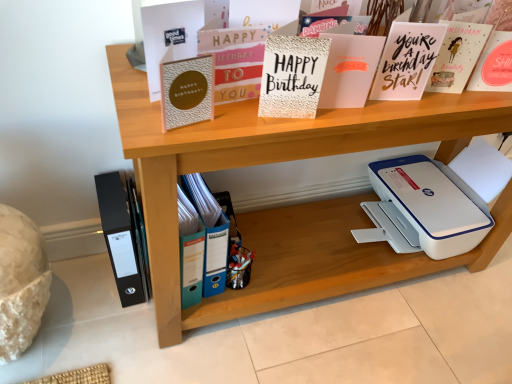
I want to click on white plastic printer at lower right, so click(424, 209).

In order to face black matte folder at lower left, should I rotate leftwards or rightwards?

A 17.359 degree turn to the left will do.

Describe the element at coordinates (192, 266) in the screenshot. I see `blue plastic ring binder at center, the seventh paperback book positioned from the right` at that location.

What is the approximate height of matte pink card at upper right, placed as the 1th paperback book when sorted from right to left?

It is 17.40 centimeters.

What do you see at coordinates (187, 91) in the screenshot? This screenshot has height=384, width=512. I see `gold textured card at upper center, which is the sixth paperback book from right to left` at bounding box center [187, 91].

Measure the distance between matte gold card at upper center, which is counted as the third paperback book, starting from the left, and camera.

matte gold card at upper center, which is counted as the third paperback book, starting from the left, is 30.93 inches away from camera.

Locate an element on the screen. metallic pen holder at center is located at coordinates (239, 266).

Describe the element at coordinates (349, 69) in the screenshot. The height and width of the screenshot is (384, 512). I see `matte gold card at center, marked as the fifth paperback book in a left-to-right arrangement` at that location.

Find the location of a particular element. Image resolution: width=512 pixels, height=384 pixels. white plastic printer at lower right is located at coordinates (424, 209).

Is black matte folder at lower left to the left of metallic pen holder at center from the viewer's perspective?

Yes, black matte folder at lower left is to the left of metallic pen holder at center.

From a real-world perspective, is black matte folder at lower left on top of metallic pen holder at center?

Indeed, from a real-world perspective, black matte folder at lower left stands above metallic pen holder at center.

In the image, there is a black matte folder at lower left. Where is `toy below it (from a real-world perspective)`? This screenshot has height=384, width=512. toy below it (from a real-world perspective) is located at coordinates (239, 266).

Which of these two, black matte folder at lower left or metallic pen holder at center, is bigger?

black matte folder at lower left is bigger.

Is metallic pen holder at center oriented away from blue plastic file at lower center?

No, metallic pen holder at center's orientation is not away from blue plastic file at lower center.

Based on the photo, from the image's perspective, between metallic pen holder at center and blue plastic file at lower center, who is located below?

metallic pen holder at center appears lower in the image.

Can you confirm if metallic pen holder at center is thinner than blue plastic file at lower center?

Yes.

Considering the positions of point (234, 262) and point (206, 221), is point (234, 262) closer or farther from the camera than point (206, 221)?

Point (234, 262) is farther from the camera than point (206, 221).

Is gold textured card at upper center, the 2th paperback book in the left-to-right sequence, oriented towards black matte folder at lower left?

No, gold textured card at upper center, the 2th paperback book in the left-to-right sequence, does not turn towards black matte folder at lower left.

How distant is gold textured card at upper center, the 2th paperback book in the left-to-right sequence, from black matte folder at lower left?

23.73 inches.

Who is more distant, gold textured card at upper center, the 2th paperback book in the left-to-right sequence, or black matte folder at lower left?

black matte folder at lower left is further from the camera.

Is gold textured card at upper center, which is the sixth paperback book from right to left, shorter than black matte folder at lower left?

Correct, gold textured card at upper center, which is the sixth paperback book from right to left, is not as tall as black matte folder at lower left.

Does textured gold card at center, which appears as the 4th paperback book when viewed from the right, appear on the right side of blue plastic ring binder at center, the first paperback book from the left?

Yes.

Between textured gold card at center, which appears as the 4th paperback book when viewed from the right, and blue plastic ring binder at center, the seventh paperback book positioned from the right, which one has more height?

With more height is blue plastic ring binder at center, the seventh paperback book positioned from the right.

Who is bigger, textured gold card at center, which appears as the 4th paperback book when viewed from the right, or blue plastic ring binder at center, the first paperback book from the left?

With larger size is textured gold card at center, which appears as the 4th paperback book when viewed from the right.

Would you say textured gold card at center, which ranks as the fourth paperback book in left-to-right order, is outside blue plastic ring binder at center, the first paperback book from the left?

Yes, textured gold card at center, which ranks as the fourth paperback book in left-to-right order, is not within blue plastic ring binder at center, the first paperback book from the left.

Which paperback book is the 5th one when counting from the front of the blue plastic file at lower center? Please provide its 2D coordinates.

[(234, 60)]

Does blue plastic file at lower center have a lesser height compared to matte gold card at upper center, which is counted as the third paperback book, starting from the left?

Incorrect, the height of blue plastic file at lower center does not fall short of that of matte gold card at upper center, which is counted as the third paperback book, starting from the left.

Which is more to the right, blue plastic file at lower center or matte gold card at upper center, which is counted as the third paperback book, starting from the left?

From the viewer's perspective, matte gold card at upper center, which is counted as the third paperback book, starting from the left, appears more on the right side.

Is blue plastic file at lower center aimed at matte gold card at upper center, arranged as the fifth paperback book when viewed from the right?

No, blue plastic file at lower center is not oriented towards matte gold card at upper center, arranged as the fifth paperback book when viewed from the right.

Can you tell me how much textured gold card at center, which appears as the 4th paperback book when viewed from the right, and wooden shelf at upper center differ in facing direction?

The angle between the facing direction of textured gold card at center, which appears as the 4th paperback book when viewed from the right, and the facing direction of wooden shelf at upper center is 13.6 degrees.

Is point (305, 46) positioned after point (309, 235)?

That is False.

Between textured gold card at center, which appears as the 4th paperback book when viewed from the right, and wooden shelf at upper center, which one appears on the left side from the viewer's perspective?

From the viewer's perspective, textured gold card at center, which appears as the 4th paperback book when viewed from the right, appears more on the left side.

Based on the photo, from a real-world perspective, is wooden shelf at upper center physically above matte pink card at upper right, positioned as the seventh paperback book in left-to-right order?

Incorrect, from a real-world perspective, wooden shelf at upper center is lower than matte pink card at upper right, positioned as the seventh paperback book in left-to-right order.

Is wooden shelf at upper center directly adjacent to matte pink card at upper right, positioned as the seventh paperback book in left-to-right order?

wooden shelf at upper center and matte pink card at upper right, positioned as the seventh paperback book in left-to-right order, are clearly separated.

Is wooden shelf at upper center facing away from matte pink card at upper right, positioned as the seventh paperback book in left-to-right order?

No.

Where is `journal lying above the metallic pen holder at center (from the image's perspective)`? journal lying above the metallic pen holder at center (from the image's perspective) is located at coordinates (122, 238).

The image size is (512, 384). I want to click on toy located underneath the blue plastic file at lower center (from a real-world perspective), so click(x=239, y=266).

Which object lies nearer to the anchor point textured gold card at center, which ranks as the fourth paperback book in left-to-right order, matte gold card at upper center, arranged as the fifth paperback book when viewed from the right, or white plastic printer at lower right?

Based on the image, matte gold card at upper center, arranged as the fifth paperback book when viewed from the right, appears to be nearer to textured gold card at center, which ranks as the fourth paperback book in left-to-right order.

From the image, which object appears to be farther from matte gold card at upper center, which appears as the 6th paperback book when viewed from the left, wooden shelf at upper center or black matte folder at lower left?

The object further to matte gold card at upper center, which appears as the 6th paperback book when viewed from the left, is black matte folder at lower left.

Looking at the image, which one is located further to blue plastic file at lower center, metallic pen holder at center or blue plastic ring binder at center, the first paperback book from the left?

metallic pen holder at center.

Estimate the real-world distances between objects in this image. Which object is further from matte pink card at upper right, positioned as the seventh paperback book in left-to-right order, blue plastic file at lower center or textured gold card at center, which appears as the 4th paperback book when viewed from the right?

Among the two, blue plastic file at lower center is located further to matte pink card at upper right, positioned as the seventh paperback book in left-to-right order.

When comparing their distances from blue plastic file at lower center, does matte gold card at center, marked as the fifth paperback book in a left-to-right arrangement, or metallic pen holder at center seem further?

matte gold card at center, marked as the fifth paperback book in a left-to-right arrangement, is further to blue plastic file at lower center.

Estimate the real-world distances between objects in this image. Which object is closer to blue plastic ring binder at center, the first paperback book from the left, matte gold card at center, which is the 3th paperback book in right-to-left order, or black matte folder at lower left?

The object closer to blue plastic ring binder at center, the first paperback book from the left, is black matte folder at lower left.

Estimate the real-world distances between objects in this image. Which object is closer to matte pink card at upper right, positioned as the seventh paperback book in left-to-right order, metallic pen holder at center or wooden shelf at upper center?

Based on the image, wooden shelf at upper center appears to be nearer to matte pink card at upper right, positioned as the seventh paperback book in left-to-right order.

Looking at the image, which one is located further to matte gold card at upper center, which is counted as the third paperback book, starting from the left, gold textured card at upper center, the 2th paperback book in the left-to-right sequence, or matte gold card at center, which is the 3th paperback book in right-to-left order?

The object further to matte gold card at upper center, which is counted as the third paperback book, starting from the left, is matte gold card at center, which is the 3th paperback book in right-to-left order.

Where is `shelf located between matte gold card at upper center, arranged as the fifth paperback book when viewed from the right, and matte pink card at upper right, positioned as the seventh paperback book in left-to-right order, in the left-right direction`? This screenshot has height=384, width=512. shelf located between matte gold card at upper center, arranged as the fifth paperback book when viewed from the right, and matte pink card at upper right, positioned as the seventh paperback book in left-to-right order, in the left-right direction is located at coordinates (294, 205).

The height and width of the screenshot is (384, 512). Identify the location of book between black matte folder at lower left and matte gold card at upper center, the 2th paperback book viewed from the right, from left to right. (209, 233).

At what (x,y) coordinates should I click in order to perform the action: click on shelf between blue plastic ring binder at center, the seventh paperback book positioned from the right, and white plastic printer at lower right, in the horizontal direction. Please return your answer as a coordinate pair (x, y). The width and height of the screenshot is (512, 384). Looking at the image, I should click on (294, 205).

Find the location of a particular element. This screenshot has width=512, height=384. journal between textured gold card at center, which appears as the 4th paperback book when viewed from the right, and blue plastic ring binder at center, the first paperback book from the left, in the vertical direction is located at coordinates (122, 238).